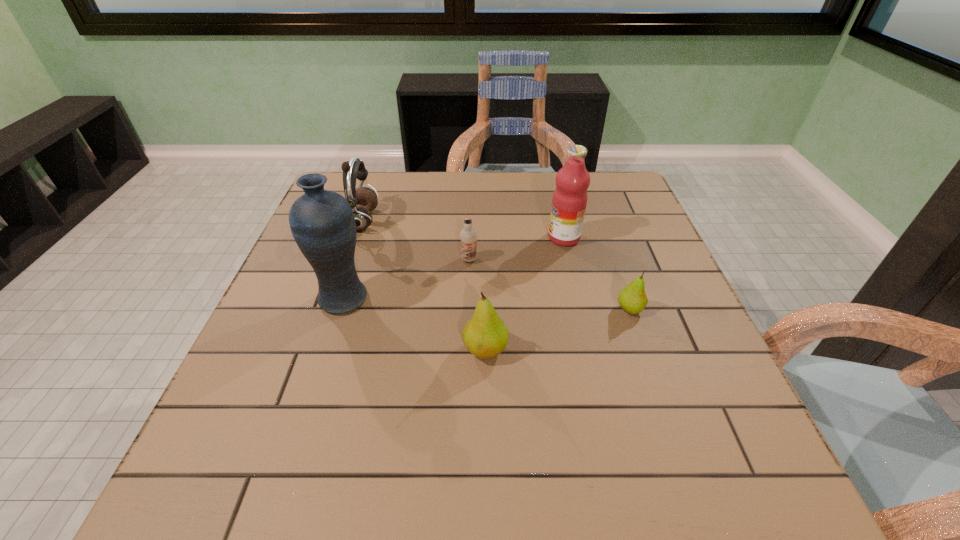
You are a GUI agent. You are given a task and a screenshot of the screen. Output one action in this format:
    pyautogui.click(x=<x>, y=<y>)
    Task: Click on the vacant space positioned 0.100m on the right of the right pear
    
    Given the screenshot: What is the action you would take?
    pyautogui.click(x=689, y=309)

The height and width of the screenshot is (540, 960). In order to click on vacant space situated on the ear pads of the third tallest object in this screenshot , I will do `click(488, 221)`.

Find the location of a particular element. The width and height of the screenshot is (960, 540). vacant space located on the label of the fifth object from left to right is located at coordinates (420, 238).

Locate an element on the screen. vacant point located on the label of the fifth object from left to right is located at coordinates (482, 238).

Where is `vacant space located 0.350m on the label of the fifth object from left to right`? vacant space located 0.350m on the label of the fifth object from left to right is located at coordinates (412, 238).

I want to click on vacant space located 0.380m on the right of the chocolate milk, so click(x=634, y=260).

You are a GUI agent. You are given a task and a screenshot of the screen. Output one action in this format:
    pyautogui.click(x=<x>, y=<y>)
    Task: Click on the vacant area located 0.050m on the left of the tallest object
    Image resolution: width=960 pixels, height=540 pixels.
    Given the screenshot: What is the action you would take?
    pyautogui.click(x=295, y=298)

Locate an element on the screen. object that is at the far edge is located at coordinates (362, 200).

You are a GUI agent. You are given a task and a screenshot of the screen. Output one action in this format:
    pyautogui.click(x=<x>, y=<y>)
    Task: Click on the earphone that is at the left edge
    Image resolution: width=960 pixels, height=540 pixels.
    Given the screenshot: What is the action you would take?
    pyautogui.click(x=362, y=200)

I want to click on vase located at the left edge, so click(x=322, y=222).